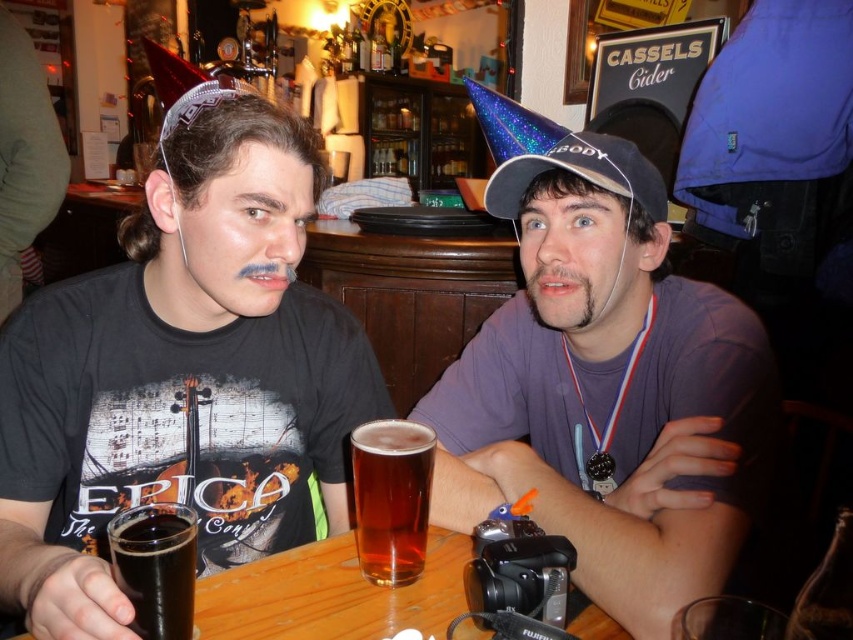
Can you confirm if black matte t-shirt at left is wider than glittery blue baseball cap at center?

Correct, the width of black matte t-shirt at left exceeds that of glittery blue baseball cap at center.

Describe the element at coordinates (181, 374) in the screenshot. This screenshot has width=853, height=640. I see `black matte t-shirt at left` at that location.

Is point (378, 408) positioned after point (505, 163)?

Yes.

The height and width of the screenshot is (640, 853). I want to click on black matte t-shirt at left, so click(181, 374).

Describe the element at coordinates (602, 380) in the screenshot. This screenshot has width=853, height=640. I see `purple matte shirt at center` at that location.

Locate an element on the screen. purple matte shirt at center is located at coordinates (602, 380).

Measure the distance from black matte t-shirt at left to amber glass beer at center.

black matte t-shirt at left is 32.55 centimeters from amber glass beer at center.

Is black matte t-shirt at left positioned in front of amber glass beer at center?

Yes, black matte t-shirt at left is closer to the viewer.

Which is behind, point (172, 308) or point (386, 436)?

Point (172, 308)

Image resolution: width=853 pixels, height=640 pixels. What are the coordinates of `black matte t-shirt at left` in the screenshot? It's located at (181, 374).